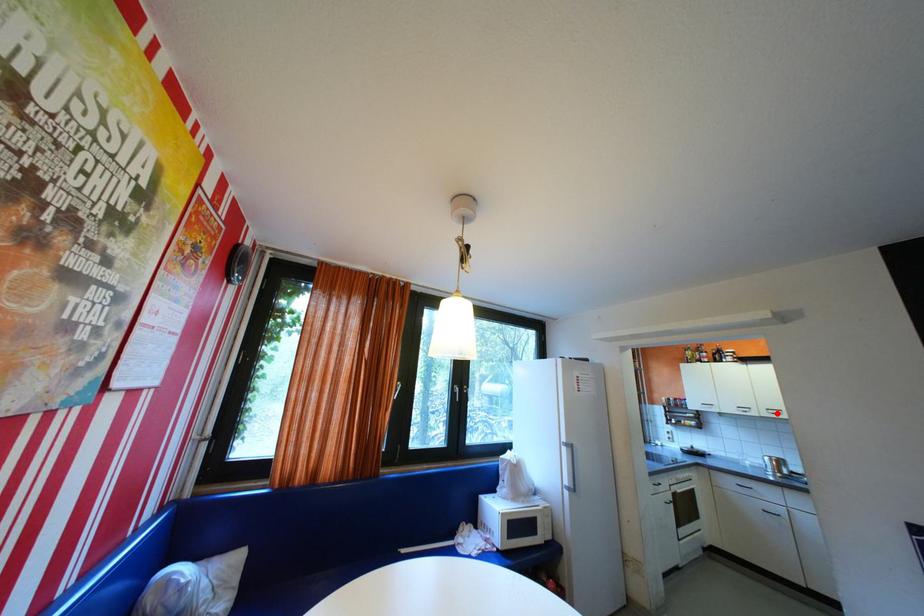
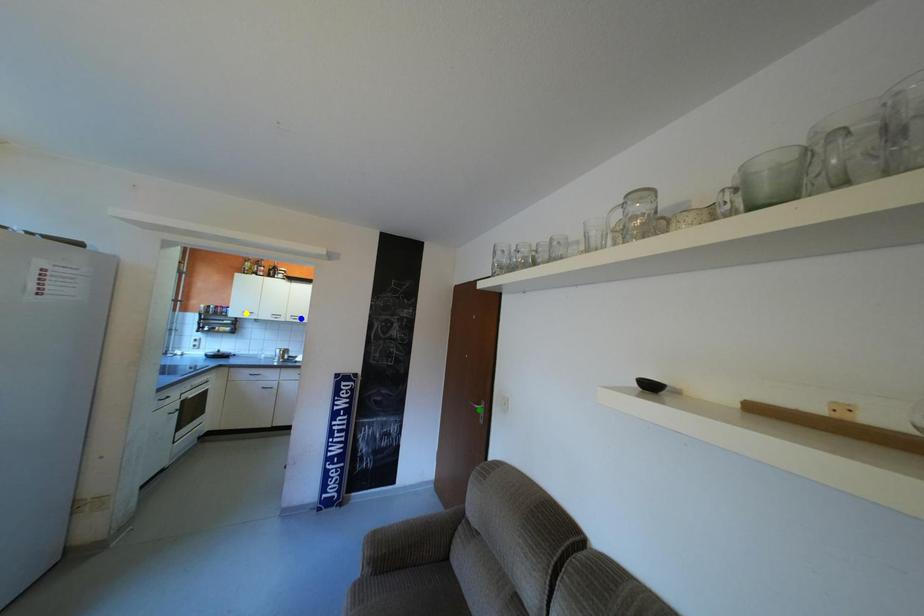
Question: I am providing you with two images of the same scene from different viewpoints. A red point is marked on the first image. You are given multiple points on the second image. Which spot in image 2 lines up with the point in image 1?

Choices:
 (A) yellow point
 (B) blue point
 (C) green point

Answer: (B)